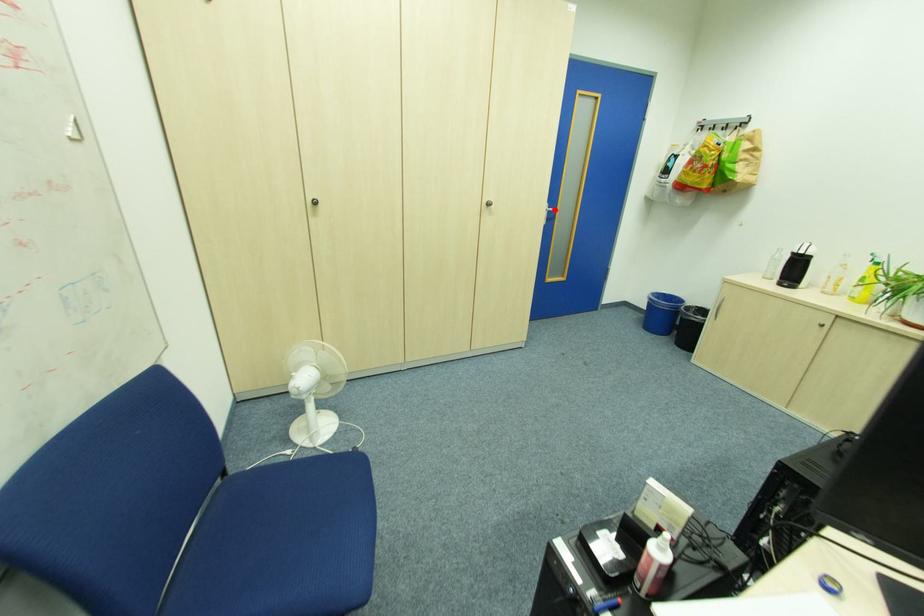
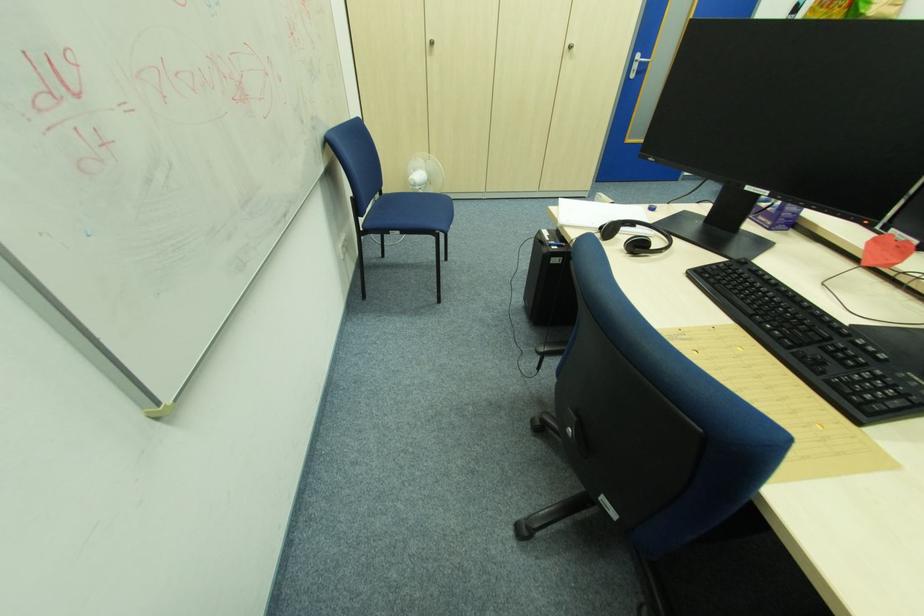
Locate, in the second image, the point that corresponds to the highlighted location in the first image.

(647, 61)